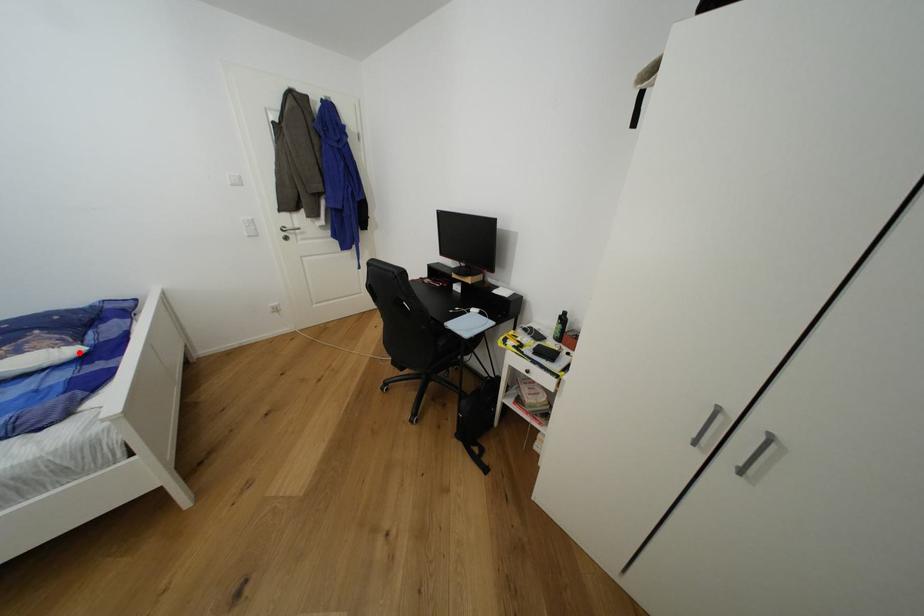
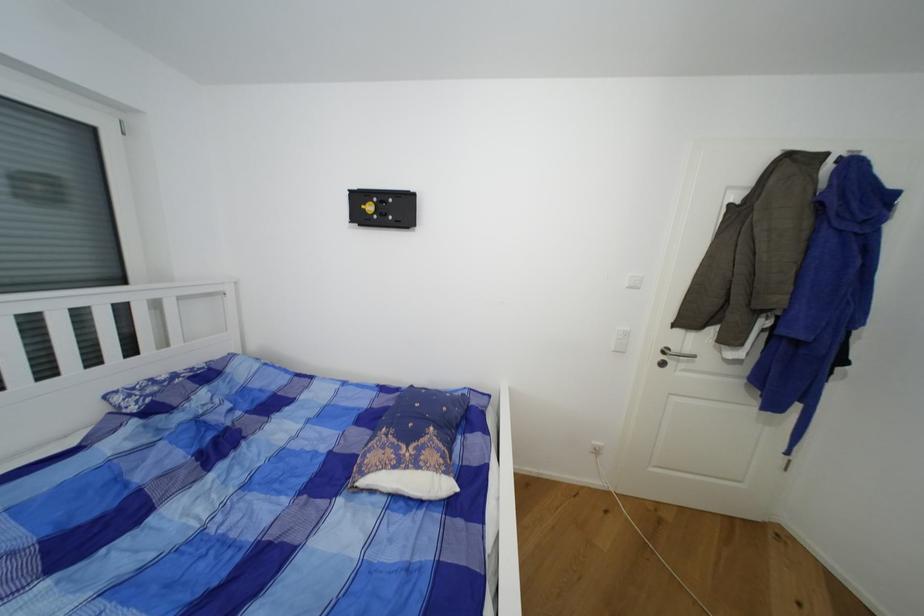
Locate, in the second image, the point that corresponds to the highlighted location in the first image.

(454, 488)